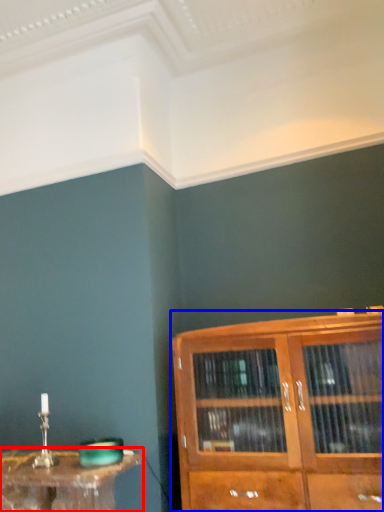
Question: Among these objects, which one is farthest to the camera, table (highlighted by a red box) or cupboard (highlighted by a blue box)?

Choices:
 (A) table
 (B) cupboard

Answer: (A)